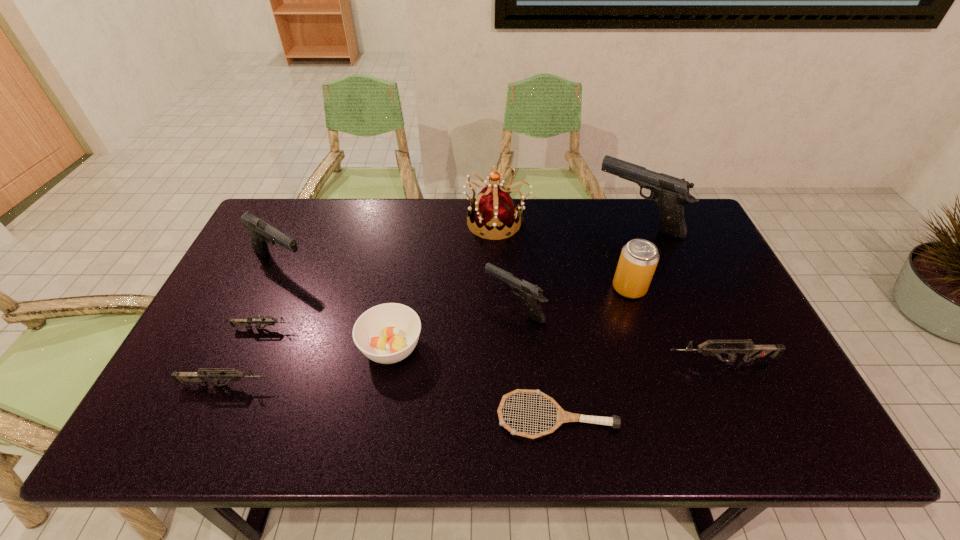
Locate an element on the screen. The height and width of the screenshot is (540, 960). vacant region at the near edge of the desktop is located at coordinates (553, 419).

Identify the location of blank space at the left edge. (218, 406).

Locate an element on the screen. free space at the right edge of the desktop is located at coordinates click(x=685, y=290).

In the image, there is a desktop. Where is `vacant space at the near right corner`? The width and height of the screenshot is (960, 540). vacant space at the near right corner is located at coordinates (744, 424).

At what (x,y) coordinates should I click in order to perform the action: click on vacant area that lies between the rightmost grey gun and the soup bowl. Please return your answer as a coordinate pair (x, y). The height and width of the screenshot is (540, 960). Looking at the image, I should click on click(x=556, y=355).

Identify the location of vacant area that lies between the smallest black gun and the pop (soda). (572, 298).

In order to click on vacant region between the nearest black gun and the fifth farthest gun in this screenshot , I will do `click(617, 334)`.

You are a GUI agent. You are given a task and a screenshot of the screen. Output one action in this format:
    pyautogui.click(x=<x>, y=<y>)
    Task: Click on the free space between the biggest grey gun and the pop (soda)
    Image resolution: width=960 pixels, height=540 pixels.
    Given the screenshot: What is the action you would take?
    pyautogui.click(x=675, y=325)

The image size is (960, 540). I want to click on free area in between the shortest gun and the farthest black gun, so click(451, 275).

Locate an element on the screen. vacant region between the nearest object and the pop (soda) is located at coordinates (593, 353).